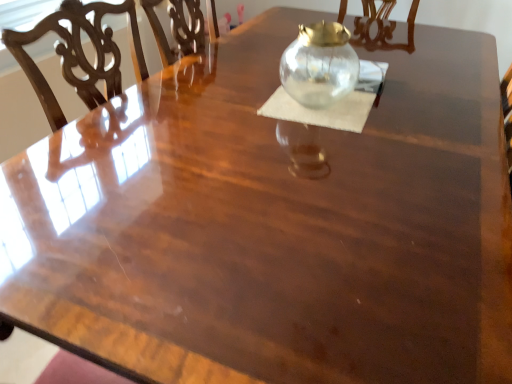
Identify the location of transparent glass vase at center. click(x=319, y=65).

Image resolution: width=512 pixels, height=384 pixels. Describe the element at coordinates (319, 65) in the screenshot. I see `transparent glass vase at center` at that location.

I want to click on transparent glass vase at center, so click(x=319, y=65).